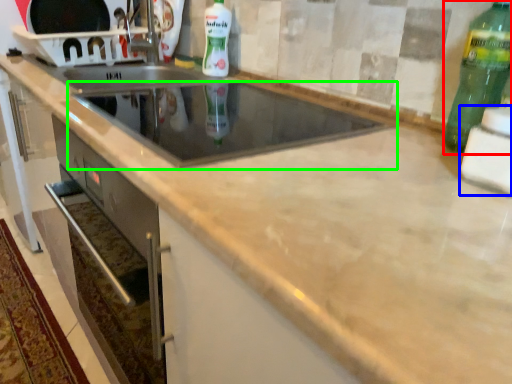
Question: Estimate the real-world distances between objects in this image. Which object is farther from bottle (highlighted by a red box), appliance (highlighted by a blue box) or appliance (highlighted by a green box)?

Choices:
 (A) appliance
 (B) appliance

Answer: (B)